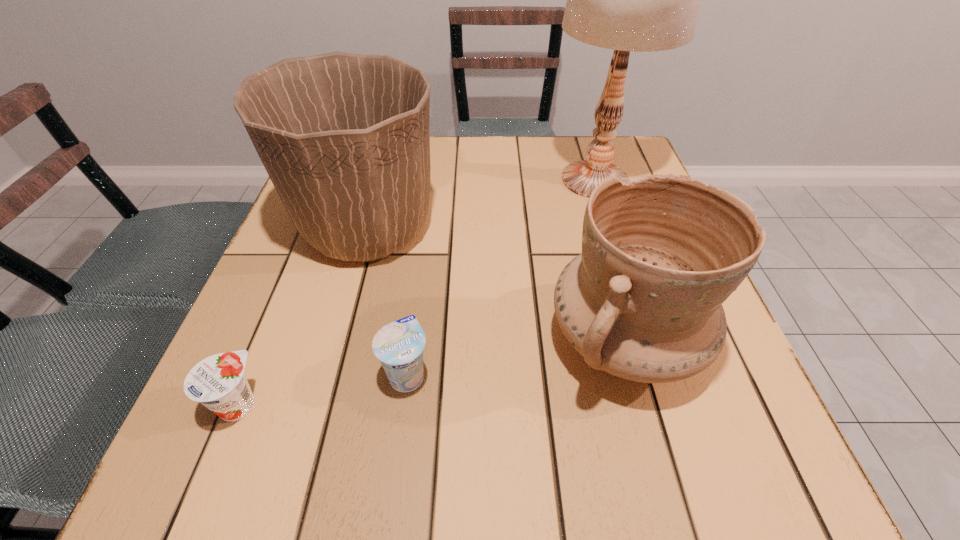
Where is `vacant space located on the back of the shortest object`? vacant space located on the back of the shortest object is located at coordinates (300, 255).

You are a GUI agent. You are given a task and a screenshot of the screen. Output one action in this format:
    pyautogui.click(x=<x>, y=<y>)
    Task: Click on the lamp located at the far edge
    This screenshot has height=540, width=960.
    Given the screenshot: What is the action you would take?
    pyautogui.click(x=642, y=0)

Locate an element on the screen. flowerpot that is at the far edge is located at coordinates 344,137.

The height and width of the screenshot is (540, 960). In order to click on flowerpot positioned at the left edge in this screenshot , I will do `click(344, 137)`.

Where is `yogurt that is at the left edge`? The height and width of the screenshot is (540, 960). yogurt that is at the left edge is located at coordinates (218, 382).

Locate an element on the screen. Image resolution: width=960 pixels, height=540 pixels. lamp that is at the right edge is located at coordinates (642, 0).

The height and width of the screenshot is (540, 960). Identify the location of pottery present at the right edge. click(660, 254).

Where is `object that is at the far left corner`? This screenshot has width=960, height=540. object that is at the far left corner is located at coordinates (344, 137).

Where is `object located at the far right corner`? object located at the far right corner is located at coordinates (642, 0).

This screenshot has height=540, width=960. I want to click on vacant area at the far edge of the desktop, so click(495, 142).